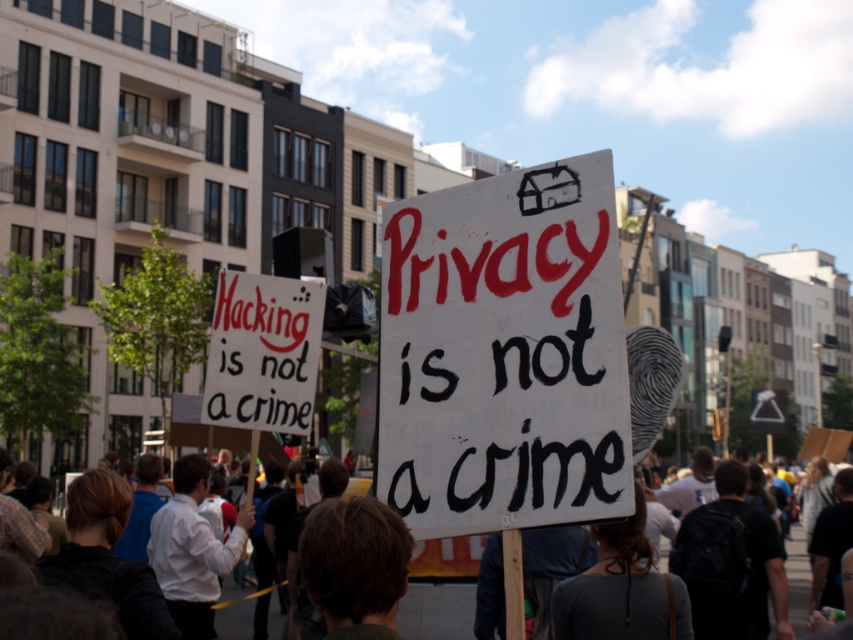
Question: Is white painted cardboard sign at center thinner than dark brown hair at center?

Choices:
 (A) yes
 (B) no

Answer: (A)

Question: Which point is closer to the camera taking this photo?

Choices:
 (A) (492, 209)
 (B) (457, 589)

Answer: (A)

Question: Is white painted cardboard sign at center closer to camera compared to white paper sign at center?

Choices:
 (A) yes
 (B) no

Answer: (A)

Question: Among these points, which one is nearest to the camera?

Choices:
 (A) (281, 326)
 (B) (805, 570)

Answer: (A)

Question: Which of these objects is positioned farthest from the white paper sign at center?

Choices:
 (A) dark brown hair at center
 (B) white painted cardboard sign at center

Answer: (A)

Question: Does white paper sign at center have a smaller size compared to dark brown hair at center?

Choices:
 (A) yes
 (B) no

Answer: (A)